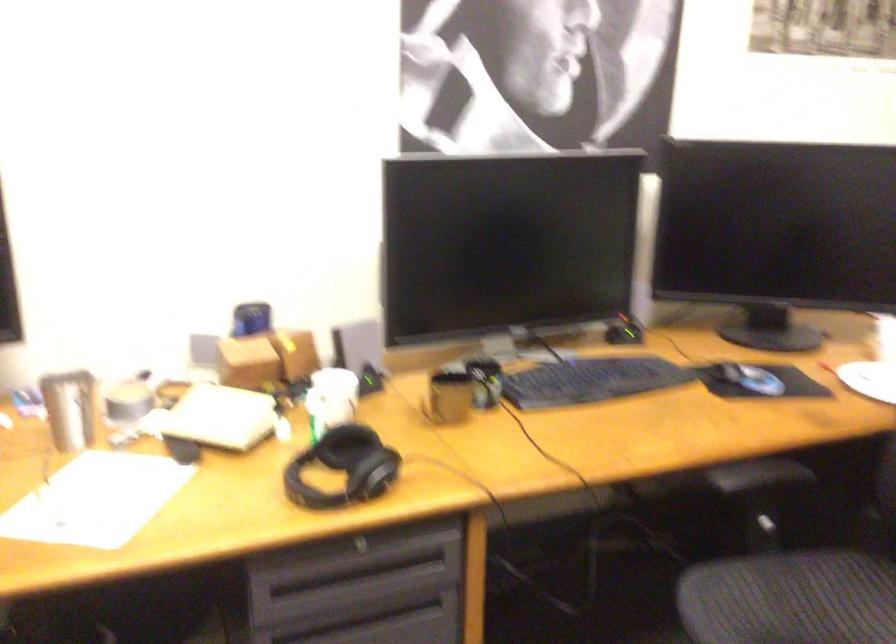
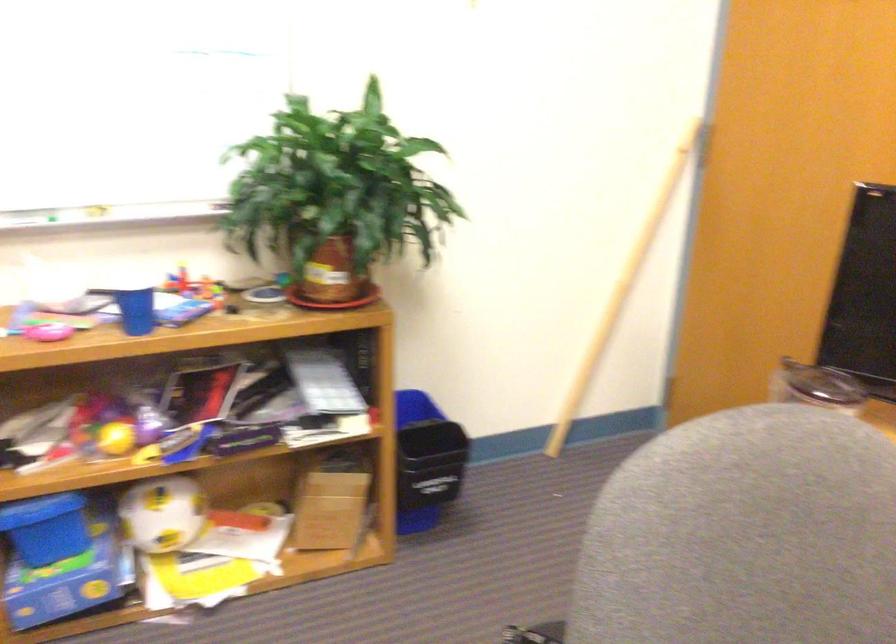
The images are taken continuously from a first-person perspective. In which direction is your viewpoint rotating?

The rotation direction of the camera is left-down.